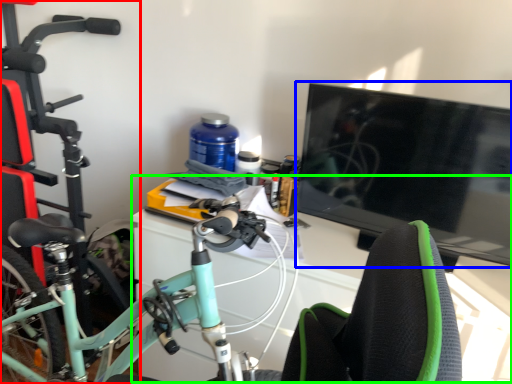
Question: Considering the real-world distances, which object is closest to bicycle (highlighted by a red box)? television (highlighted by a blue box) or computer desk (highlighted by a green box).

Choices:
 (A) television
 (B) computer desk

Answer: (B)